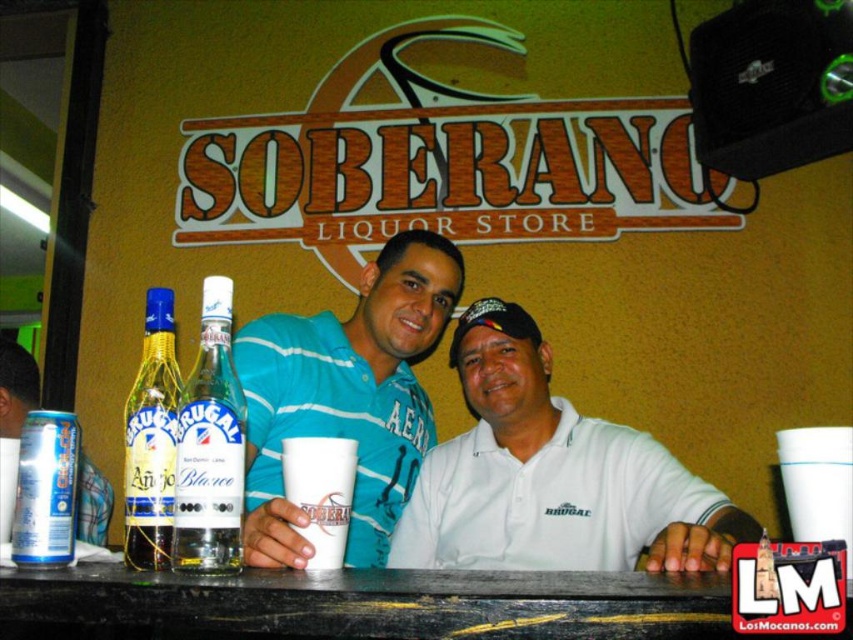
You are a customer at the Soberano Liquor Store and want to buy both the clear glass bottle at center and the silver metallic can at lower left. The store has a promotion where you get a discount if you choose the larger item. Which item should you pick to qualify for the discount?

The clear glass bottle at center is larger in size than the silver metallic can at lower left, so you should pick the clear glass bottle at center to qualify for the discount.

You are a customer at the Soberano Liquor Store and want to pick up the silver metallic can at lower left to pay for it. Can you reach it without moving the clear glass bottle at center?

The silver metallic can at lower left is behind the clear glass bottle at center, so you cannot reach it without moving the clear glass bottle at center.